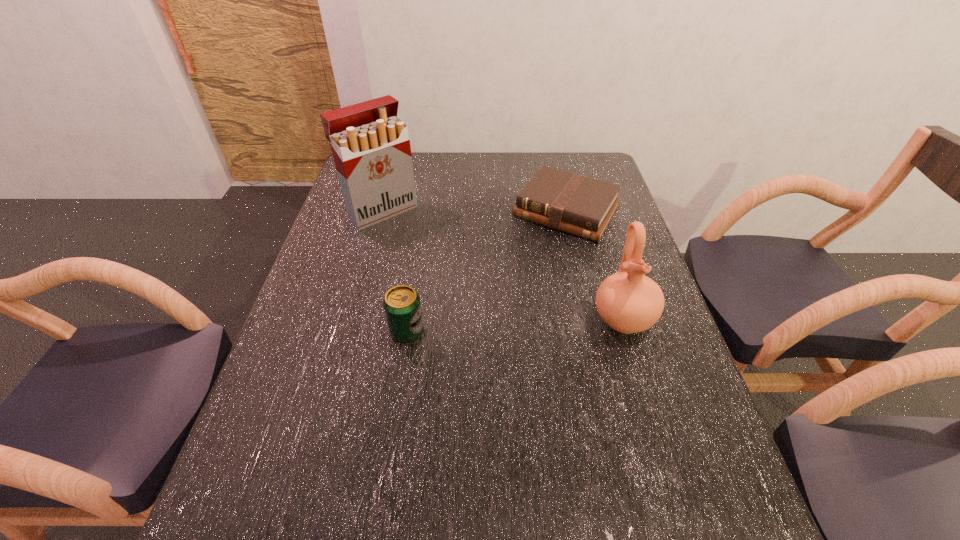
Find the location of a particular element. Image resolution: width=960 pixels, height=540 pixels. free space at the far right corner of the desktop is located at coordinates (589, 172).

I want to click on free spot between the second shortest object and the pottery, so click(515, 326).

Locate an element on the screen. The width and height of the screenshot is (960, 540). vacant space that is in between the shortest object and the third shortest object is located at coordinates (594, 265).

Where is `free point between the third tallest object and the shortest object`? The image size is (960, 540). free point between the third tallest object and the shortest object is located at coordinates (487, 272).

Where is `free spot between the cigarette case and the third tallest object`? free spot between the cigarette case and the third tallest object is located at coordinates (395, 272).

The image size is (960, 540). What are the coordinates of `vacant area that lies between the cigarette case and the shortest object` in the screenshot? It's located at (474, 211).

Identify the location of vacant area that lies between the third tallest object and the cigarette case. The width and height of the screenshot is (960, 540). (395, 272).

Find the location of `free point between the second shortest object and the shortest object`. free point between the second shortest object and the shortest object is located at coordinates (487, 272).

Identify the location of blank region between the cigarette case and the third shortest object. (503, 265).

Where is `vacant space in between the tallest object and the Bible`? vacant space in between the tallest object and the Bible is located at coordinates (474, 211).